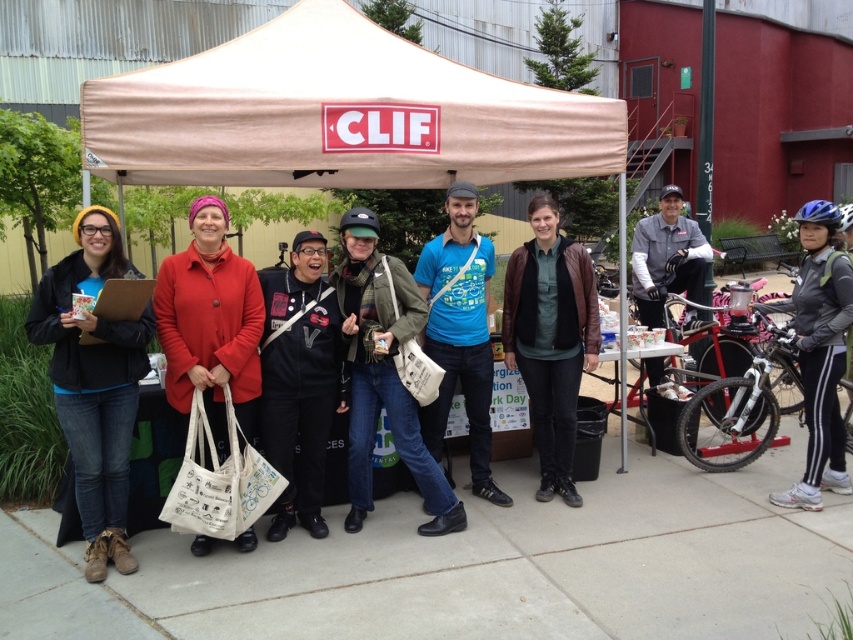
Question: Which point is closer to the camera?

Choices:
 (A) (526, 243)
 (B) (784, 500)
 (C) (51, 353)

Answer: (C)

Question: Does matte red coat at center have a lesser width compared to gray matte jacket at right?

Choices:
 (A) yes
 (B) no

Answer: (A)

Question: Which point is closer to the camera?

Choices:
 (A) matte black jacket at left
 (B) gray/leather jacket at center
 (C) blue matte bicycle helmet at upper right
 (D) concrete sidewalk at center

Answer: (D)

Question: From the image, what is the correct spatial relationship of gray/leather jacket at center in relation to blue matte bicycle helmet at upper right?

Choices:
 (A) right
 (B) left

Answer: (B)

Question: Based on their relative distances, which object is farther from the black matte jacket at center?

Choices:
 (A) blue matte bicycle helmet at upper right
 (B) matte red coat at center
 (C) matte black jacket at left

Answer: (A)

Question: Can you confirm if beige fabric canopy at center is smaller than gray matte jacket at right?

Choices:
 (A) no
 (B) yes

Answer: (A)